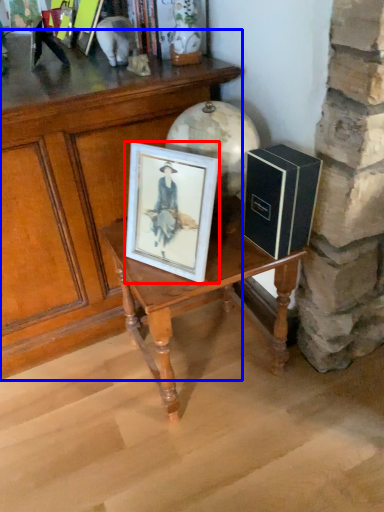
Question: Which object appears closest to the camera in this image, picture frame (highlighted by a red box) or table (highlighted by a blue box)?

Choices:
 (A) picture frame
 (B) table

Answer: (A)